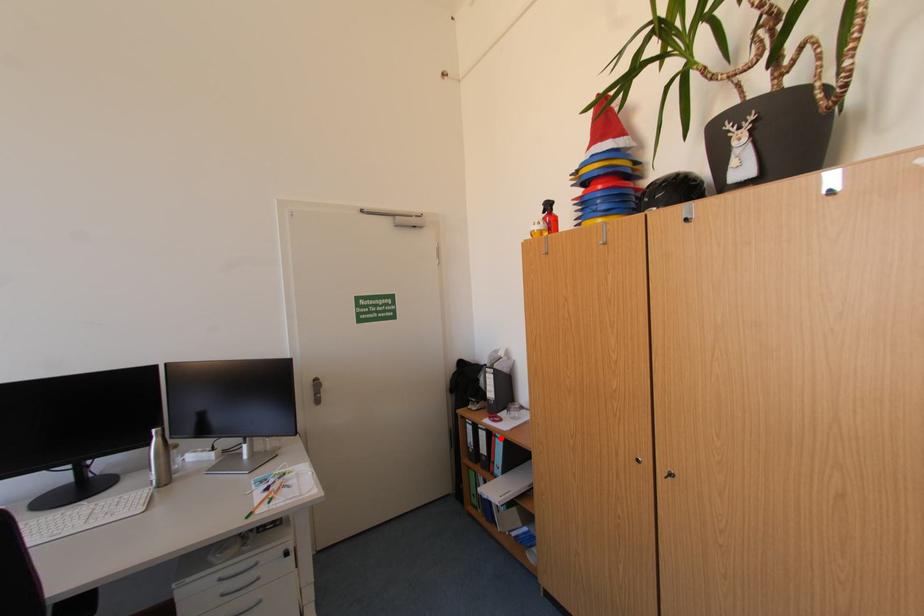
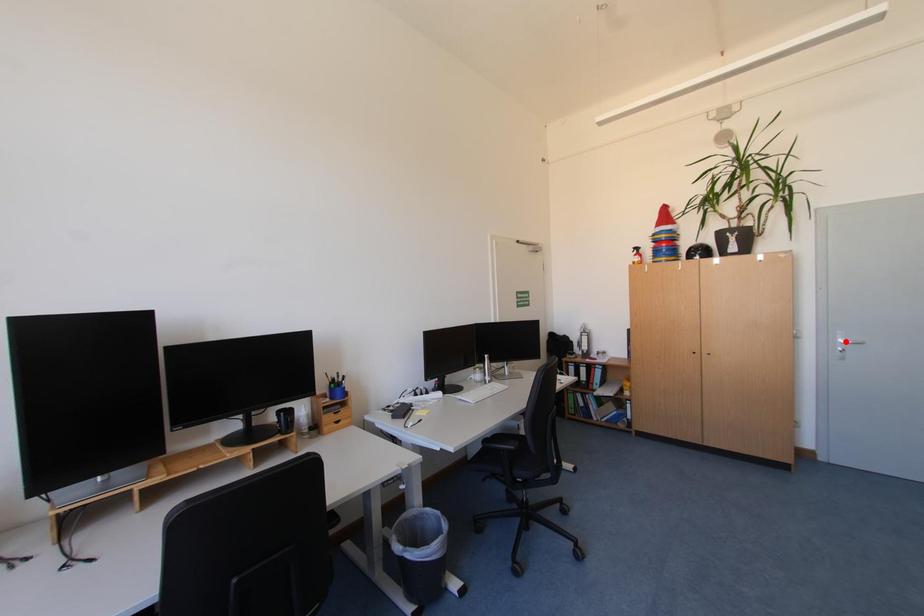
I am providing you with two images of the same scene from different viewpoints. A red point is marked on the first image and another point is marked on the second image. Do the highlighted points in image1 and image2 indicate the same real-world spot?

No